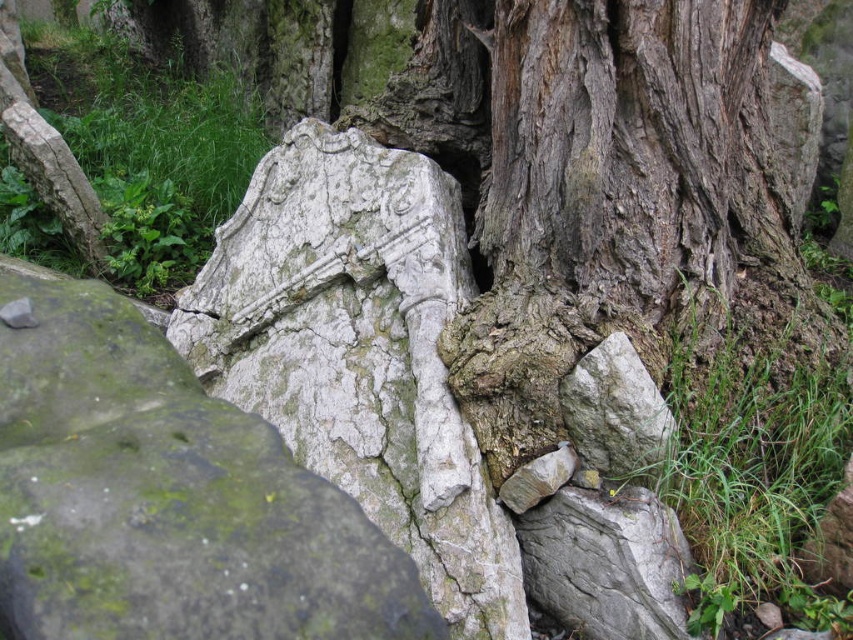
Can you confirm if weathered stone at center is bigger than gray rough rock at center?

Indeed, weathered stone at center has a larger size compared to gray rough rock at center.

Which is behind, point (183, 627) or point (601, 352)?

The point (601, 352) is more distant.

You are a GUI agent. You are given a task and a screenshot of the screen. Output one action in this format:
    pyautogui.click(x=<x>, y=<y>)
    Task: Click on the weathered stone at center
    
    Given the screenshot: What is the action you would take?
    pyautogui.click(x=166, y=497)

Is weathered stone at center shorter than white cracked stone at center?

Yes.

At what (x,y) coordinates should I click in order to perform the action: click on weathered stone at center. Please return your answer as a coordinate pair (x, y). This screenshot has height=640, width=853. Looking at the image, I should click on (166, 497).

Can you confirm if white cracked stone at center is positioned to the right of gray rough rock at center?

No, white cracked stone at center is not to the right of gray rough rock at center.

Does white cracked stone at center lie behind gray rough rock at center?

No, it is not.

Where is `white cracked stone at center`? white cracked stone at center is located at coordinates click(x=360, y=353).